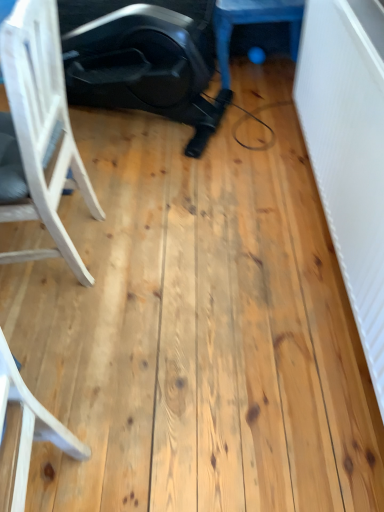
Question: Are white wood chair at left and blue rubber ball at upper center far apart?

Choices:
 (A) no
 (B) yes

Answer: (B)

Question: Can you confirm if white wood chair at left is wider than blue rubber ball at upper center?

Choices:
 (A) no
 (B) yes

Answer: (A)

Question: Is white wood chair at left closer to the viewer compared to blue rubber ball at upper center?

Choices:
 (A) no
 (B) yes

Answer: (B)

Question: Is white wood chair at left smaller than blue rubber ball at upper center?

Choices:
 (A) yes
 (B) no

Answer: (B)

Question: From a real-world perspective, is white wood chair at left over blue rubber ball at upper center?

Choices:
 (A) no
 (B) yes

Answer: (B)

Question: From the image's perspective, is white wood chair at left over blue rubber ball at upper center?

Choices:
 (A) no
 (B) yes

Answer: (A)

Question: Can white wood chair at left be found inside blue rubber ball at upper center?

Choices:
 (A) no
 (B) yes

Answer: (A)

Question: Is blue rubber ball at upper center in front of white wood chair at left?

Choices:
 (A) yes
 (B) no

Answer: (B)

Question: From a real-world perspective, is blue rubber ball at upper center on top of white wood chair at left?

Choices:
 (A) no
 (B) yes

Answer: (A)

Question: Is blue rubber ball at upper center at the left side of white wood chair at left?

Choices:
 (A) yes
 (B) no

Answer: (B)

Question: Considering the relative sizes of blue rubber ball at upper center and white wood chair at left in the image provided, is blue rubber ball at upper center wider than white wood chair at left?

Choices:
 (A) no
 (B) yes

Answer: (B)

Question: From a real-world perspective, is blue rubber ball at upper center physically below white wood chair at left?

Choices:
 (A) no
 (B) yes

Answer: (B)

Question: Is blue rubber ball at upper center wider or thinner than white wood chair at left?

Choices:
 (A) wide
 (B) thin

Answer: (A)